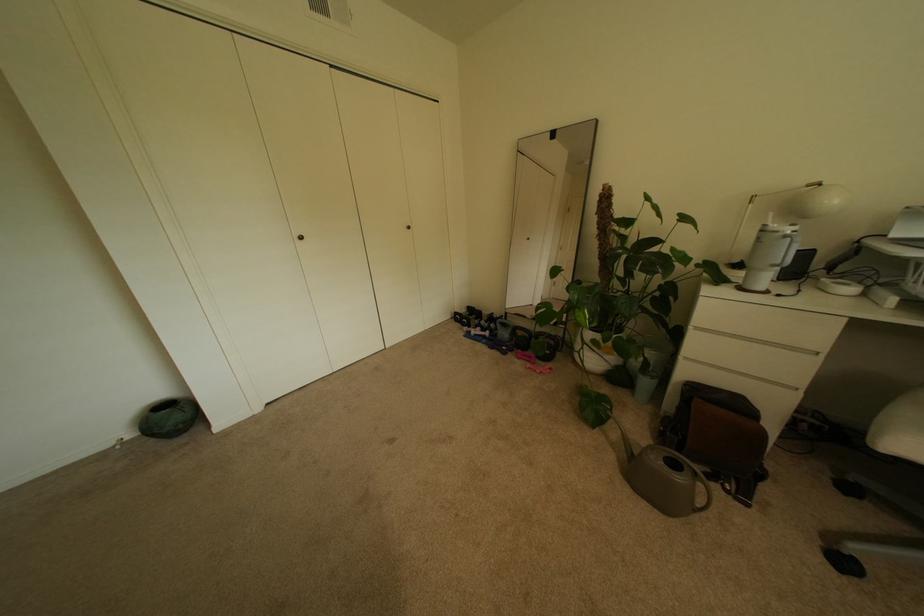
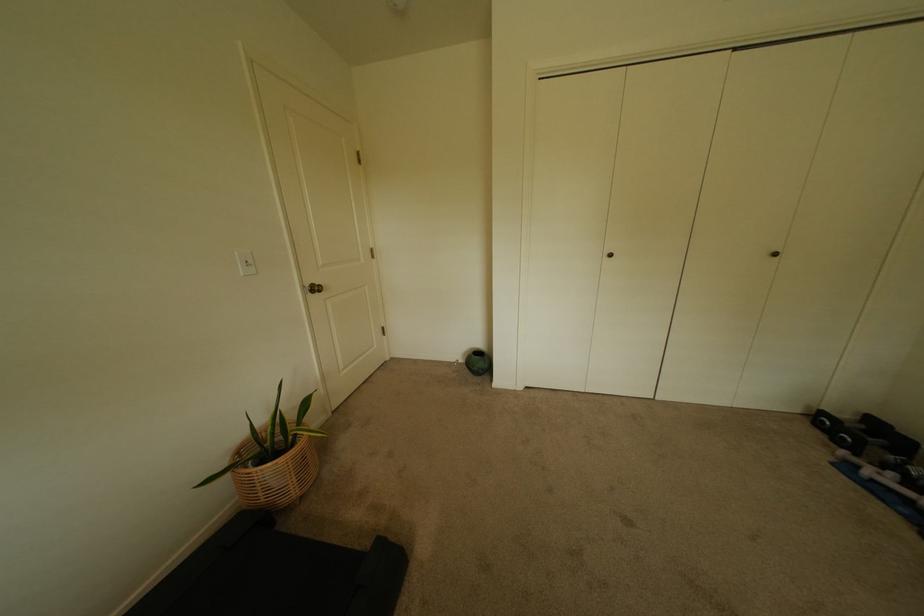
In the second image, find the point that corresponds to point 418,229 in the first image.

(784, 256)